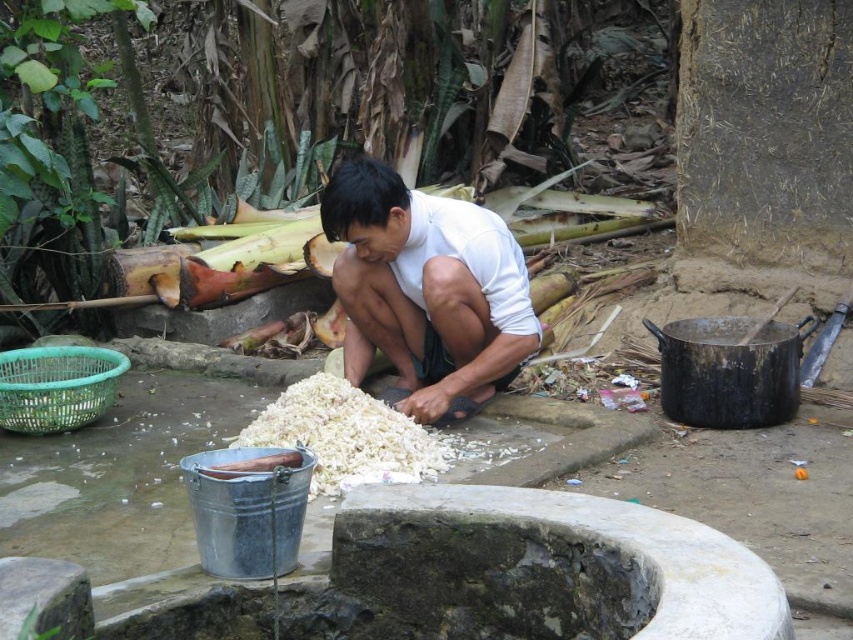
Image resolution: width=853 pixels, height=640 pixels. What do you see at coordinates (426, 289) in the screenshot?
I see `white matte shirt at center` at bounding box center [426, 289].

Can you confirm if white matte shirt at center is smaller than white fluffy food at center?

No, white matte shirt at center is not smaller than white fluffy food at center.

Find the location of a particular element. This screenshot has width=853, height=640. white matte shirt at center is located at coordinates (426, 289).